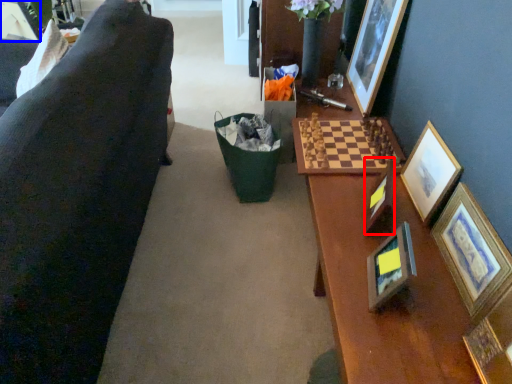
Question: Which point is further to the camera, picture frame (highlighted by a red box) or picture frame (highlighted by a blue box)?

Choices:
 (A) picture frame
 (B) picture frame

Answer: (B)